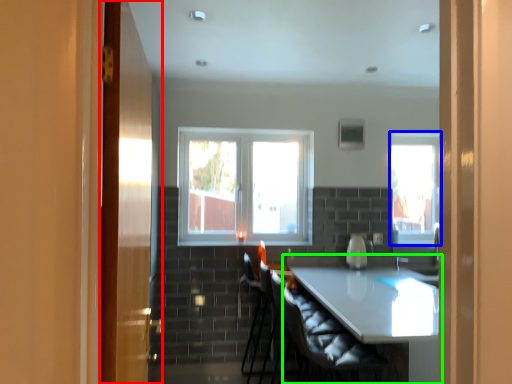
Question: Which is farther away from door (highlighted by a red box)? window (highlighted by a blue box) or table (highlighted by a green box)?

Choices:
 (A) window
 (B) table

Answer: (A)